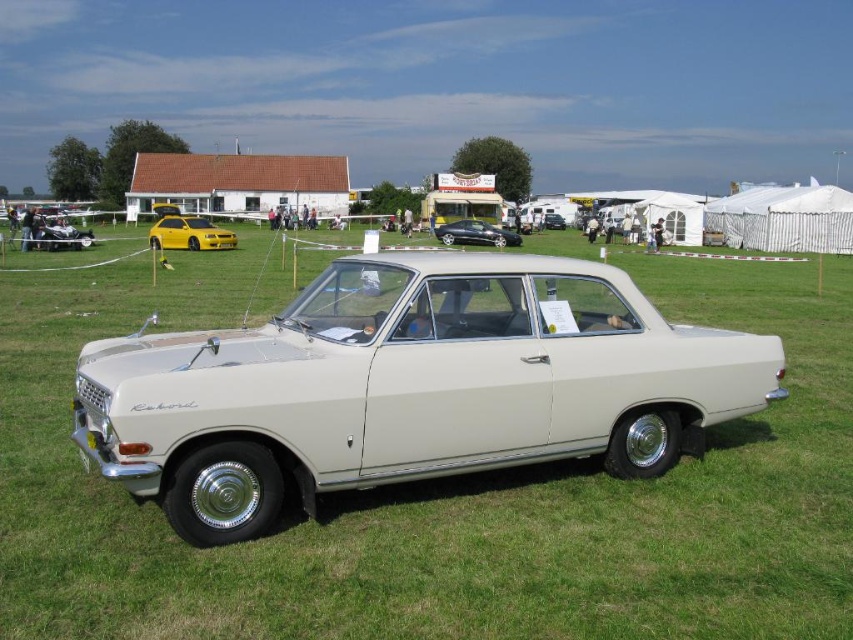
How far apart are beige metallic sedan at center and satin black sedan at center?

beige metallic sedan at center is 34.63 meters from satin black sedan at center.

Who is taller, beige metallic sedan at center or satin black sedan at center?

Standing taller between the two is satin black sedan at center.

Does point (292, 356) come in front of point (495, 234)?

That is True.

Locate an element on the screen. beige metallic sedan at center is located at coordinates (409, 385).

This screenshot has width=853, height=640. What do you see at coordinates (189, 234) in the screenshot? I see `yellow metallic hatchback at center` at bounding box center [189, 234].

Which is behind, point (184, 220) or point (552, 216)?

Point (552, 216)

Locate an element on the screen. The height and width of the screenshot is (640, 853). yellow metallic hatchback at center is located at coordinates (189, 234).

Describe the element at coordinates (409, 385) in the screenshot. This screenshot has height=640, width=853. I see `beige metallic sedan at center` at that location.

Can you confirm if beige metallic sedan at center is bigger than white glossy sedan at center?

Incorrect, beige metallic sedan at center is not larger than white glossy sedan at center.

Is point (160, 454) positioned in front of point (554, 220)?

Yes, it is in front of point (554, 220).

You are a GUI agent. You are given a task and a screenshot of the screen. Output one action in this format:
    pyautogui.click(x=<x>, y=<y>)
    Task: Click on the beige metallic sedan at center
    
    Given the screenshot: What is the action you would take?
    pyautogui.click(x=409, y=385)